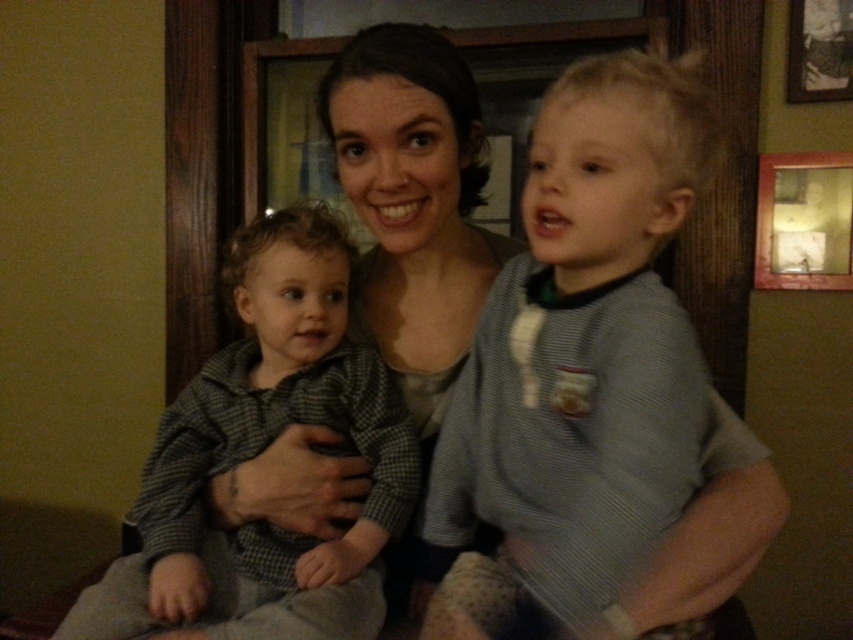
Looking at this image, is gray striped shirt at right below checkered fabric toddler at center?

Actually, gray striped shirt at right is above checkered fabric toddler at center.

Does gray striped shirt at right have a lesser height compared to checkered fabric toddler at center?

Incorrect, gray striped shirt at right's height does not fall short of checkered fabric toddler at center's.

Between point (613, 490) and point (169, 408), which one is positioned behind?

Positioned behind is point (169, 408).

Identify the location of gray striped shirt at right. Image resolution: width=853 pixels, height=640 pixels. (581, 358).